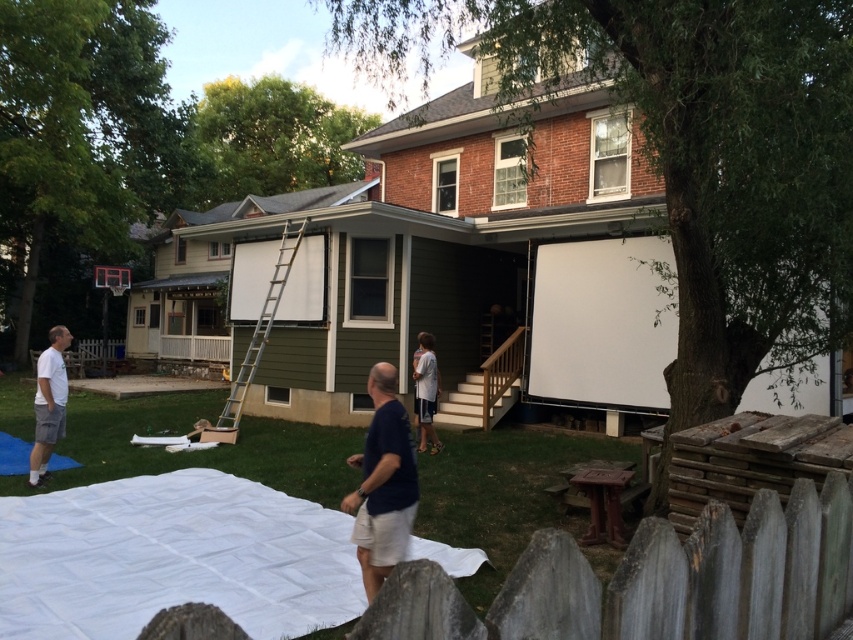
Locate an element on the screen. Image resolution: width=853 pixels, height=640 pixels. dark blue t-shirt at center is located at coordinates [383, 483].

Who is shorter, dark blue t-shirt at center or silver metallic ladder at center?

With less height is dark blue t-shirt at center.

Where is `dark blue t-shirt at center`? dark blue t-shirt at center is located at coordinates (383, 483).

In the scene shown: Is white matte shirt at lower left positioned before white cotton shirt at center?

Yes, it is in front of white cotton shirt at center.

Locate an element on the screen. This screenshot has height=640, width=853. white matte shirt at lower left is located at coordinates (49, 403).

Is dark blue t-shirt at center above white matte shirt at lower left?

No, dark blue t-shirt at center is not above white matte shirt at lower left.

Is dark blue t-shirt at center shorter than white matte shirt at lower left?

Correct, dark blue t-shirt at center is not as tall as white matte shirt at lower left.

Is point (358, 458) in front of point (48, 416)?

Yes, it is in front of point (48, 416).

At what (x,y) coordinates should I click in order to perform the action: click on dark blue t-shirt at center. Please return your answer as a coordinate pair (x, y). This screenshot has width=853, height=640. Looking at the image, I should click on (383, 483).